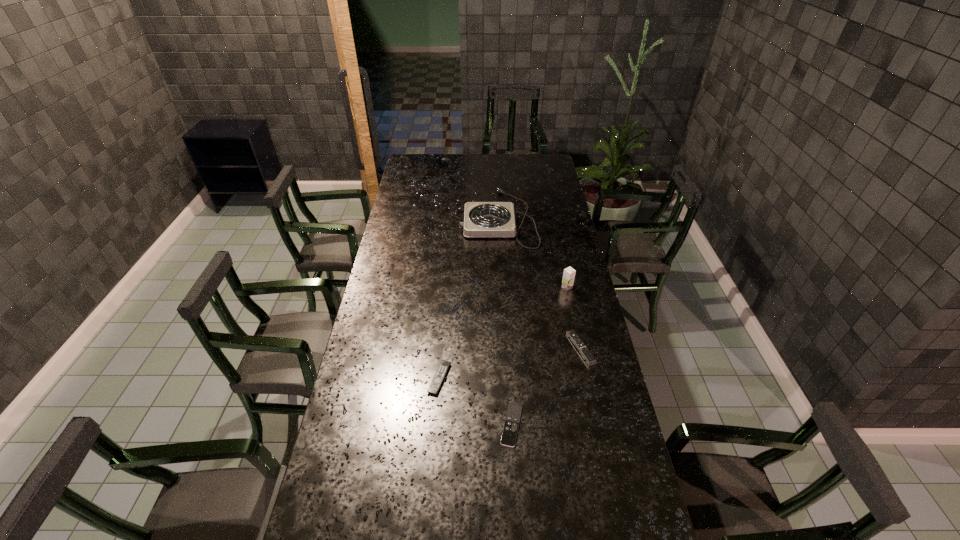
What are the coordinates of `free space located 0.260m on the front of the tallest object` in the screenshot? It's located at (579, 341).

In order to click on vacant space located with a retractable cable on the side of the farthest object in this screenshot , I will do `click(395, 218)`.

In order to click on free space located with a retractable cable on the side of the farthest object in this screenshot , I will do `click(425, 218)`.

Where is `free space located with a retractable cable on the side of the farthest object`? free space located with a retractable cable on the side of the farthest object is located at coordinates pyautogui.click(x=445, y=218).

Where is `vacant space located on the left of the third shortest object`? This screenshot has height=540, width=960. vacant space located on the left of the third shortest object is located at coordinates (540, 348).

At what (x,y) coordinates should I click in order to perform the action: click on vacant space situated on the left of the second shortest remote control. Please return your answer as a coordinate pair (x, y). The height and width of the screenshot is (540, 960). Looking at the image, I should click on (393, 379).

Locate an element on the screen. free space located on the left of the nearest object is located at coordinates click(371, 425).

Locate an element on the screen. The width and height of the screenshot is (960, 540). chocolate milk present at the right edge is located at coordinates (569, 273).

Locate an element on the screen. Image resolution: width=960 pixels, height=540 pixels. hotplate that is at the right edge is located at coordinates (481, 219).

Where is `remote control that is at the right edge`? Image resolution: width=960 pixels, height=540 pixels. remote control that is at the right edge is located at coordinates (583, 349).